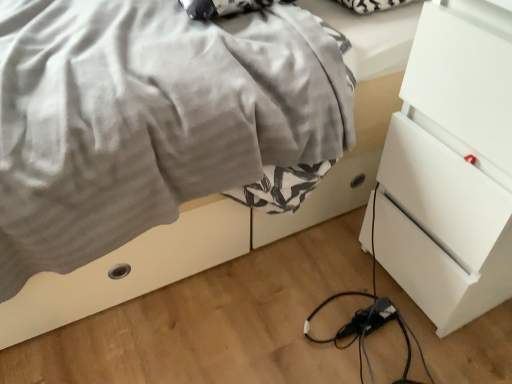
Question: Considering the positions of satin gray blanket at center and black plastic extension cord at lower center in the image, is satin gray blanket at center bigger or smaller than black plastic extension cord at lower center?

Choices:
 (A) small
 (B) big

Answer: (B)

Question: Is satin gray blanket at center to the left or to the right of black plastic extension cord at lower center in the image?

Choices:
 (A) left
 (B) right

Answer: (A)

Question: Estimate the real-world distances between objects in this image. Which object is farther from the satin gray blanket at center?

Choices:
 (A) black plastic extension cord at lower center
 (B) white glossy chest of drawers at right

Answer: (A)

Question: Which of these objects is positioned closest to the black plastic extension cord at lower center?

Choices:
 (A) white glossy chest of drawers at right
 (B) satin gray blanket at center

Answer: (A)